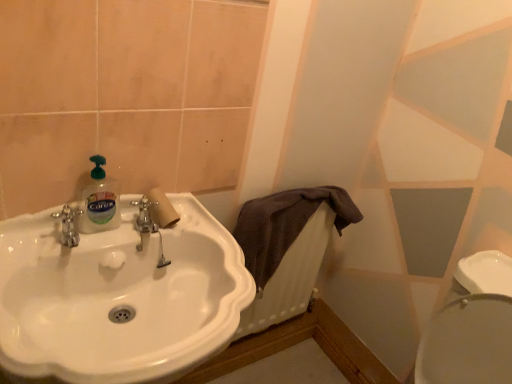
Where is `free space in front of translucent plastic bottle at sink left`? The image size is (512, 384). free space in front of translucent plastic bottle at sink left is located at coordinates (66, 245).